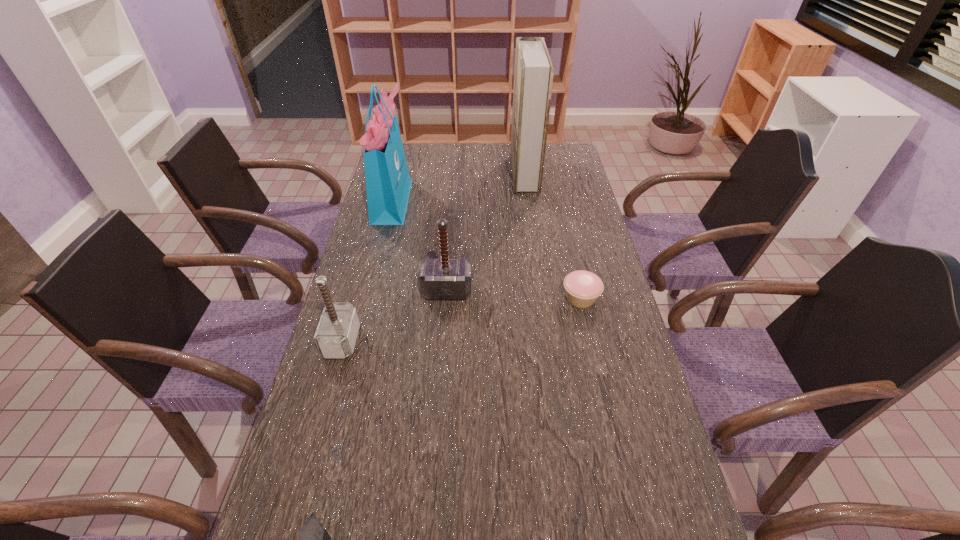
Find the location of a particular element. The image size is (960, 540). vacant space located 0.160m on the left of the farthest hammer is located at coordinates (368, 292).

Locate an element on the screen. This screenshot has height=540, width=960. blank space located for striking with the head of the second farthest hammer is located at coordinates (392, 341).

The height and width of the screenshot is (540, 960). Find the location of `vacant space located 0.230m on the front of the second shortest object`. vacant space located 0.230m on the front of the second shortest object is located at coordinates (x=600, y=384).

You are a GUI agent. You are given a task and a screenshot of the screen. Output one action in this format:
    pyautogui.click(x=<x>, y=<y>)
    Task: Click on the object located at the far edge
    The height and width of the screenshot is (540, 960).
    Given the screenshot: What is the action you would take?
    pyautogui.click(x=533, y=74)

This screenshot has width=960, height=540. Find the location of `shopping bag at the left edge`. shopping bag at the left edge is located at coordinates (388, 183).

You are a GUI agent. You are given a task and a screenshot of the screen. Output one action in this format:
    pyautogui.click(x=<x>, y=<y>)
    Task: Click on the hammer that is at the left edge
    Image resolution: width=960 pixels, height=540 pixels.
    Given the screenshot: What is the action you would take?
    pyautogui.click(x=336, y=334)

The image size is (960, 540). What are the coordinates of `object situated at the right edge` in the screenshot? It's located at (583, 288).

At what (x,y) coordinates should I click in order to perform the action: click on free location at the left edge of the desktop. Please return your answer as a coordinate pair (x, y). This screenshot has height=540, width=960. Looking at the image, I should click on (366, 241).

Identify the location of vacant point at the right edge. (562, 194).

Find the location of a particular element. This screenshot has height=540, width=960. free space at the far right corner of the desktop is located at coordinates (549, 172).